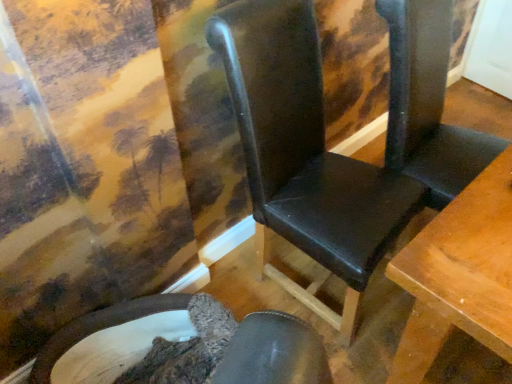
Question: From a real-world perspective, is black leather folding chair at center positioned under velvet-like brown chair at lower left, placed as the 2th chair when sorted from right to left, based on gravity?

Choices:
 (A) no
 (B) yes

Answer: (A)

Question: Would you say black leather folding chair at center contains velvet-like brown chair at lower left, the first chair when ordered from left to right?

Choices:
 (A) no
 (B) yes

Answer: (A)

Question: Can you confirm if black leather folding chair at center is bigger than velvet-like brown chair at lower left, placed as the 2th chair when sorted from right to left?

Choices:
 (A) no
 (B) yes

Answer: (B)

Question: Is black leather folding chair at center positioned in front of velvet-like brown chair at lower left, the first chair when ordered from left to right?

Choices:
 (A) no
 (B) yes

Answer: (A)

Question: Is the position of black leather folding chair at center more distant than that of velvet-like brown chair at lower left, placed as the 2th chair when sorted from right to left?

Choices:
 (A) yes
 (B) no

Answer: (A)

Question: From the image's perspective, is black leather folding chair at center positioned above or below black leather chair at center, which is the second chair from left to right?

Choices:
 (A) above
 (B) below

Answer: (A)

Question: From their relative heights in the image, would you say black leather folding chair at center is taller or shorter than black leather chair at center, which is the second chair from left to right?

Choices:
 (A) short
 (B) tall

Answer: (B)

Question: Choose the correct answer: Is black leather folding chair at center inside black leather chair at center, which is the second chair from left to right, or outside it?

Choices:
 (A) outside
 (B) inside

Answer: (A)

Question: In the image, is black leather folding chair at center positioned in front of or behind black leather chair at center, which is the second chair from left to right?

Choices:
 (A) front
 (B) behind

Answer: (B)

Question: Is black leather chair at center, which is the second chair from left to right, in front of or behind black leather folding chair at center in the image?

Choices:
 (A) behind
 (B) front

Answer: (B)

Question: From a real-world perspective, is black leather chair at center, which is the second chair from left to right, positioned above or below black leather folding chair at center?

Choices:
 (A) below
 (B) above

Answer: (A)

Question: Is black leather chair at center, positioned as the first chair in right-to-left order, inside or outside of black leather folding chair at center?

Choices:
 (A) outside
 (B) inside

Answer: (A)

Question: Based on their sizes in the image, would you say black leather chair at center, which is the second chair from left to right, is bigger or smaller than black leather folding chair at center?

Choices:
 (A) big
 (B) small

Answer: (A)

Question: Looking at their shapes, would you say black leather chair at center, which is the second chair from left to right, is wider or thinner than velvet-like brown chair at lower left, the first chair when ordered from left to right?

Choices:
 (A) thin
 (B) wide

Answer: (B)

Question: In terms of height, does black leather chair at center, which is the second chair from left to right, look taller or shorter compared to velvet-like brown chair at lower left, placed as the 2th chair when sorted from right to left?

Choices:
 (A) tall
 (B) short

Answer: (A)